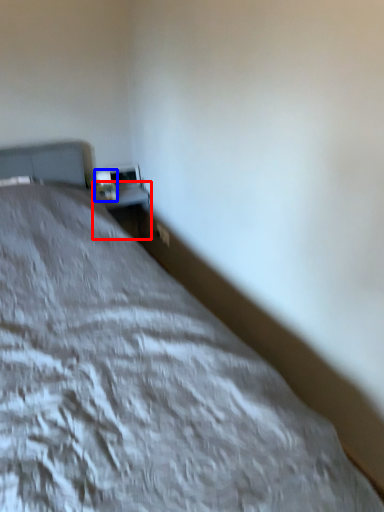
Question: Which object is closer to the camera taking this photo, table (highlighted by a red box) or table lamp (highlighted by a blue box)?

Choices:
 (A) table
 (B) table lamp

Answer: (B)